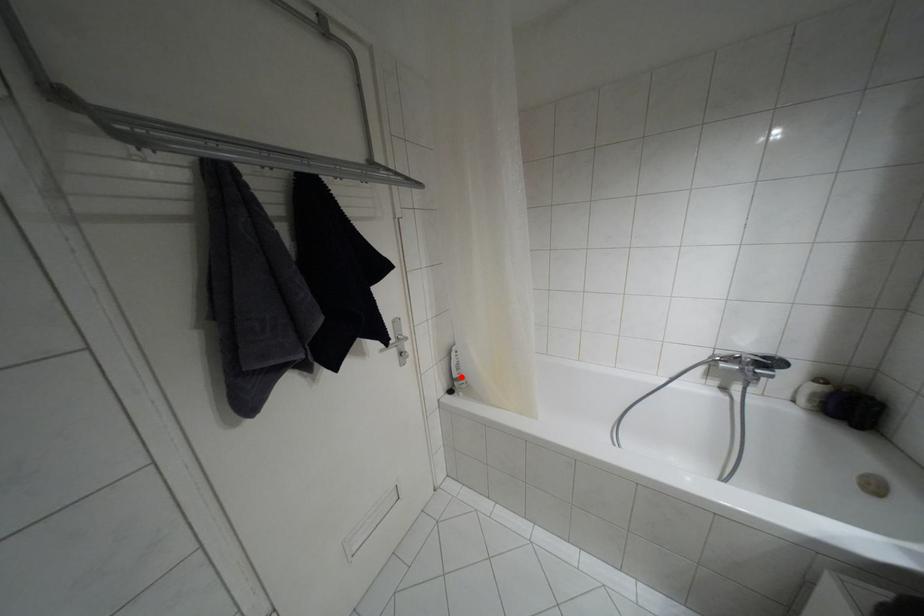
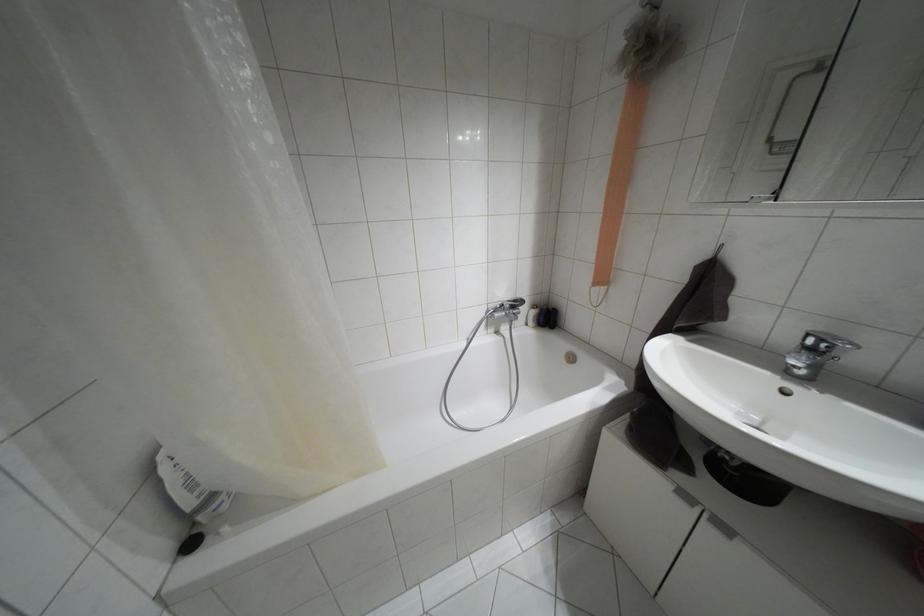
Question: I am providing you with two images of the same scene from different viewpoints. Given a red point in image1, look at the same physical point in image2. Is it:

Choices:
 (A) Closer to the viewpoint
 (B) Farther from the viewpoint

Answer: (A)